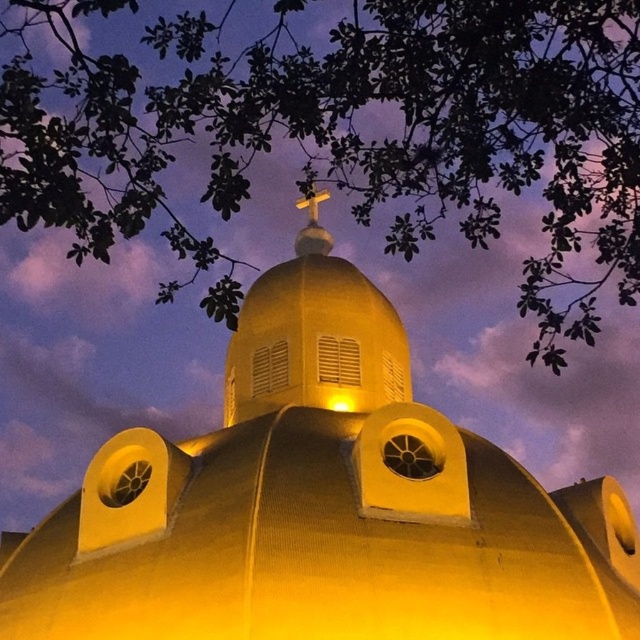
You are an architect analyzing the structure of the golden matte dome at center and the green leafy tree at upper center. Which object is located lower in the image?

The golden matte dome at center is positioned under the green leafy tree at upper center, so it is located lower in the image.

You are an architect analyzing the composition of the dome structure. Which object, the green leafy tree at upper center or the gold metallic cross at center, is located to the right of the other?

The green leafy tree at upper center is positioned on the right side of gold metallic cross at center.

You are standing in front of the golden dome structure. If you were to draw a line from your current position to the point at coordinates (321, 504), which object would that line point to?

The point at coordinates (321, 504) corresponds to the golden matte dome at center, so the line would point to the golden matte dome at center.